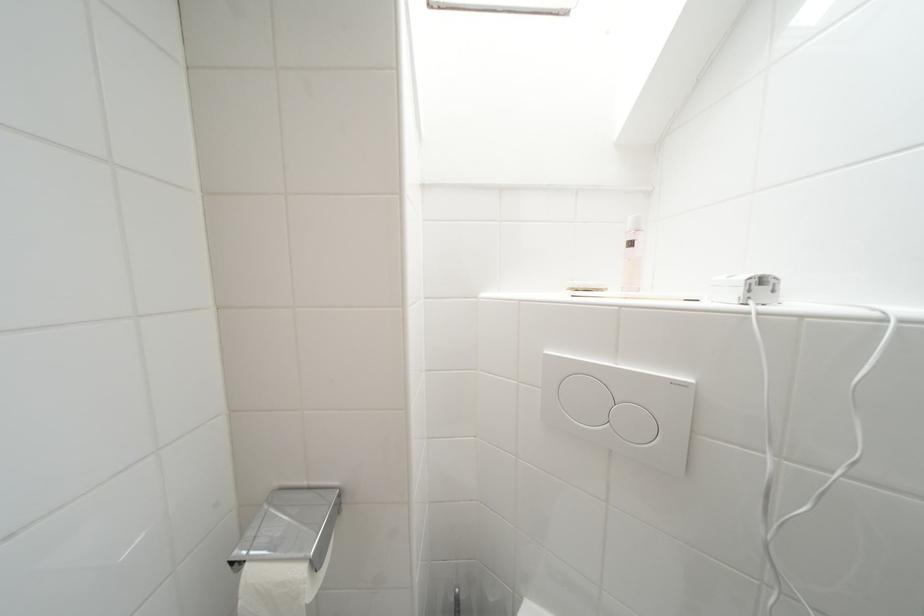
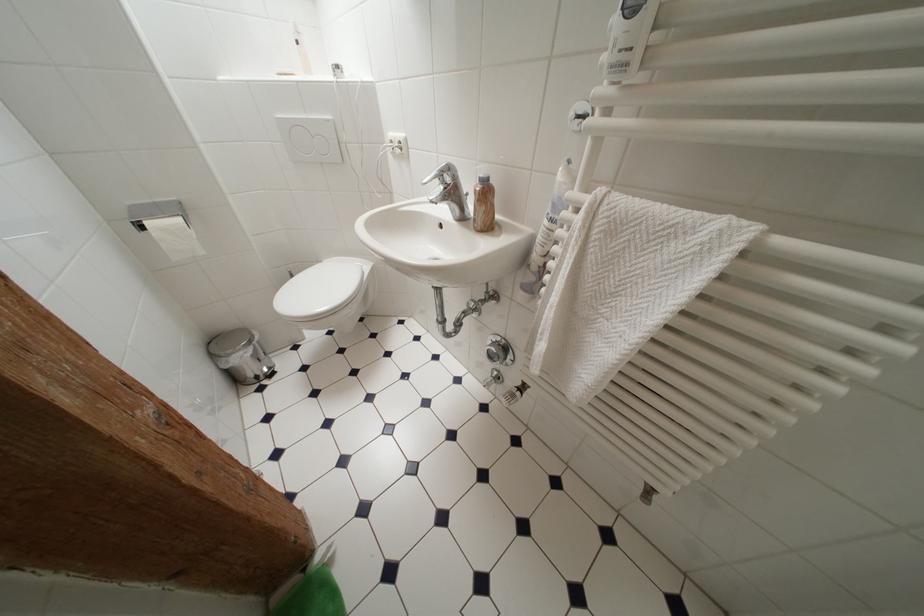
Find the pixel in the second image that matches point (681, 387) in the first image.

(333, 124)